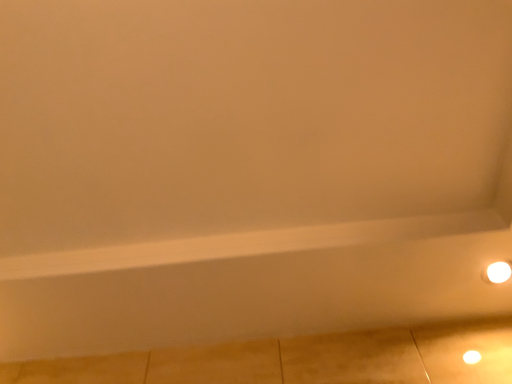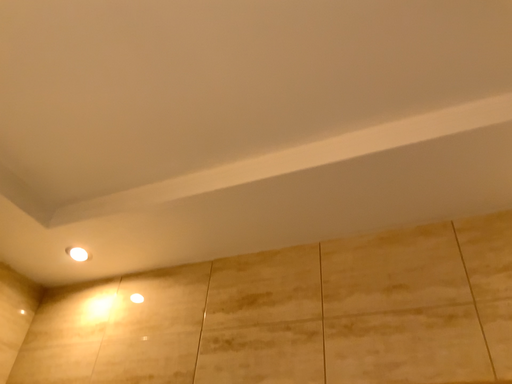
Question: How did the camera likely rotate when shooting the video?

Choices:
 (A) rotated right
 (B) rotated left

Answer: (B)